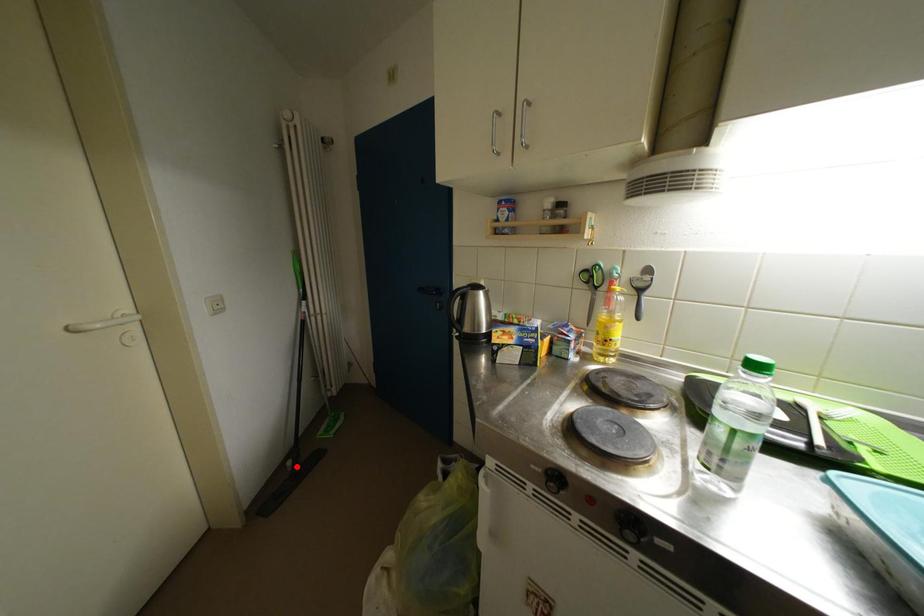
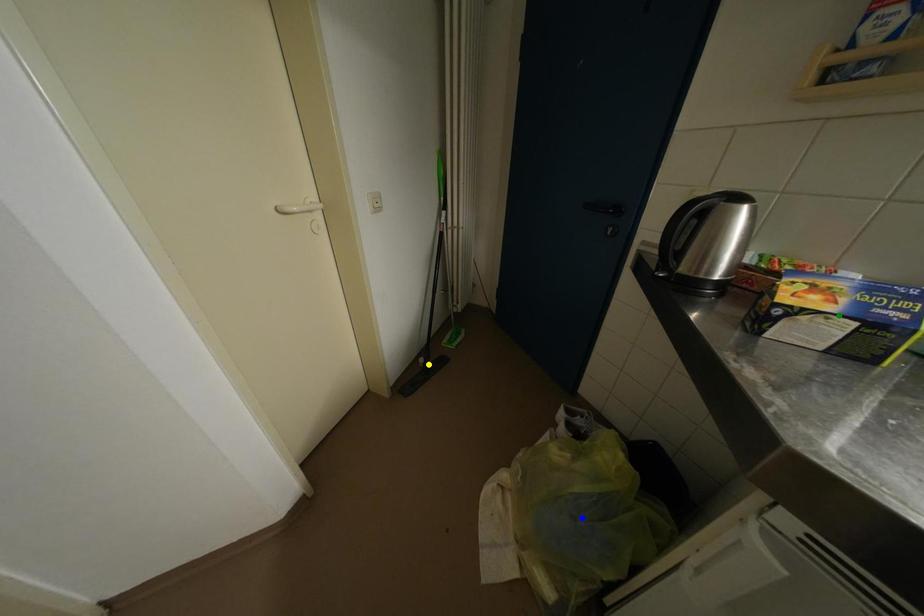
Question: I am providing you with two images of the same scene from different viewpoints. A red point is marked on the first image. You are given multiple points on the second image. Which mark in image 2 goes with the point in image 1?

Choices:
 (A) blue point
 (B) green point
 (C) yellow point

Answer: (C)